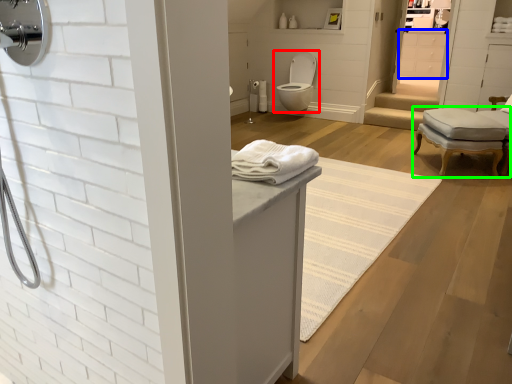
Question: Considering the real-world distances, which object is closest to toilet (highlighted by a red box)? cabinetry (highlighted by a blue box) or chair (highlighted by a green box).

Choices:
 (A) cabinetry
 (B) chair

Answer: (A)